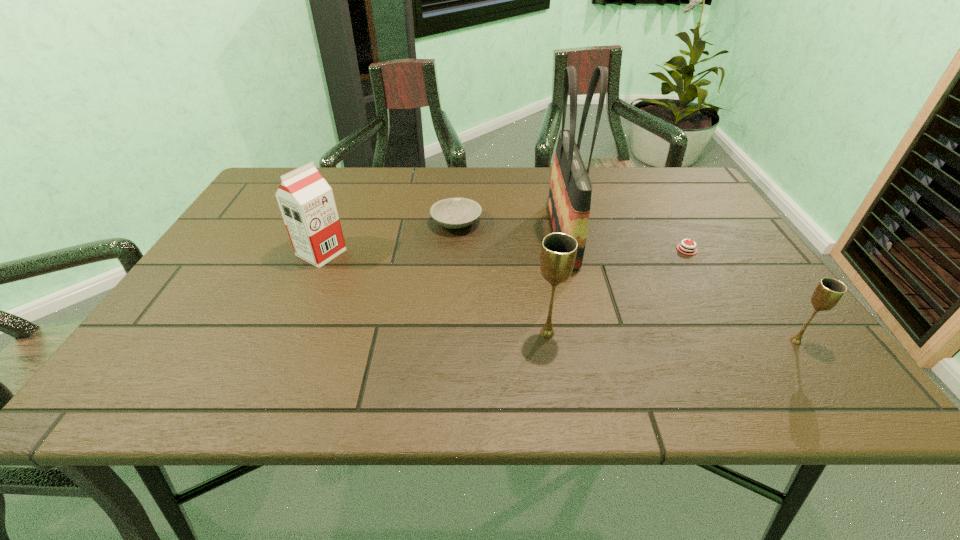
Identify the location of vacant point located between the chocolate cake and the rightmost object. (741, 295).

This screenshot has height=540, width=960. Find the location of `empty space between the right chalice and the second shortest object`. empty space between the right chalice and the second shortest object is located at coordinates (626, 282).

Locate an element on the screen. This screenshot has width=960, height=540. vacant space in between the fifth object from left to right and the soya milk is located at coordinates (504, 251).

Locate an element on the screen. Image resolution: width=960 pixels, height=540 pixels. free spot between the shortest object and the leftmost object is located at coordinates (504, 251).

Identify the location of vacant point located between the shortest object and the shorter chalice. (741, 295).

The width and height of the screenshot is (960, 540). Find the location of `empty space between the third object from right to left and the shortest object`. empty space between the third object from right to left and the shortest object is located at coordinates (625, 241).

Locate an element on the screen. free spot between the third object from left to right and the rightmost object is located at coordinates (671, 337).

Image resolution: width=960 pixels, height=540 pixels. In order to click on free spot between the tallest object and the soya milk in this screenshot , I will do `click(443, 243)`.

Where is `object identified as the fourth closest to the fifth tallest object`? The image size is (960, 540). object identified as the fourth closest to the fifth tallest object is located at coordinates (686, 249).

This screenshot has width=960, height=540. Find the location of `object that is the fifth closest one to the third shortest object`. object that is the fifth closest one to the third shortest object is located at coordinates (306, 201).